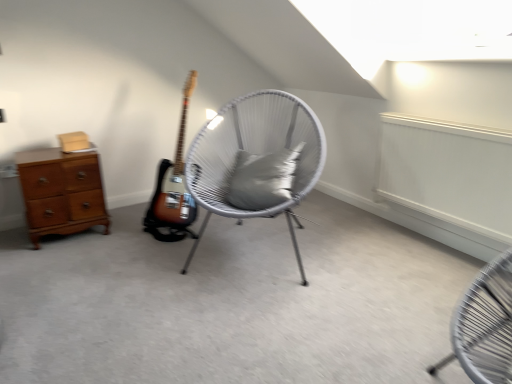
Question: In terms of width, does wooden chest of drawers at left look wider or thinner when compared to gray fabric pillow at center?

Choices:
 (A) thin
 (B) wide

Answer: (B)

Question: Would you say wooden chest of drawers at left is inside or outside gray fabric pillow at center?

Choices:
 (A) outside
 (B) inside

Answer: (A)

Question: Based on their relative distances, which object is farther from the white woven chair at center?

Choices:
 (A) gray fabric pillow at center
 (B) wooden chest of drawers at left

Answer: (B)

Question: Which is farther from the white woven chair at center?

Choices:
 (A) wooden chest of drawers at left
 (B) gray fabric pillow at center

Answer: (A)